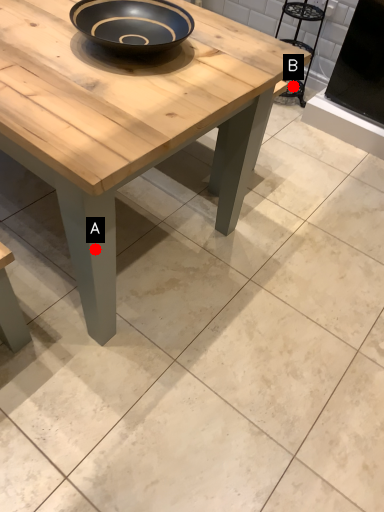
Question: Two points are circled on the image, labeled by A and B beside each circle. Which point is further to the camera?

Choices:
 (A) A is further
 (B) B is further

Answer: (B)